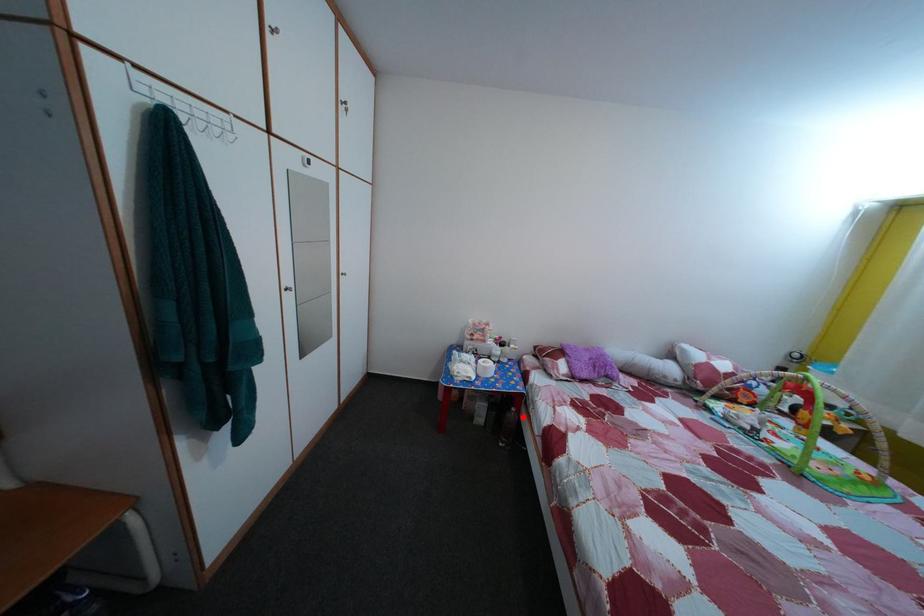
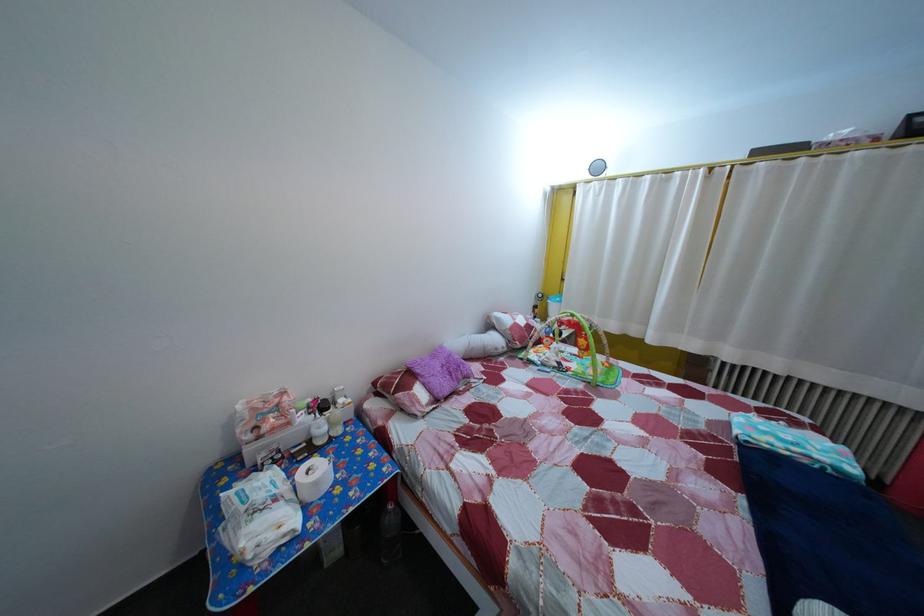
The point at the highlighted location is marked in the first image. Where is the corresponding point in the second image?

(399, 515)